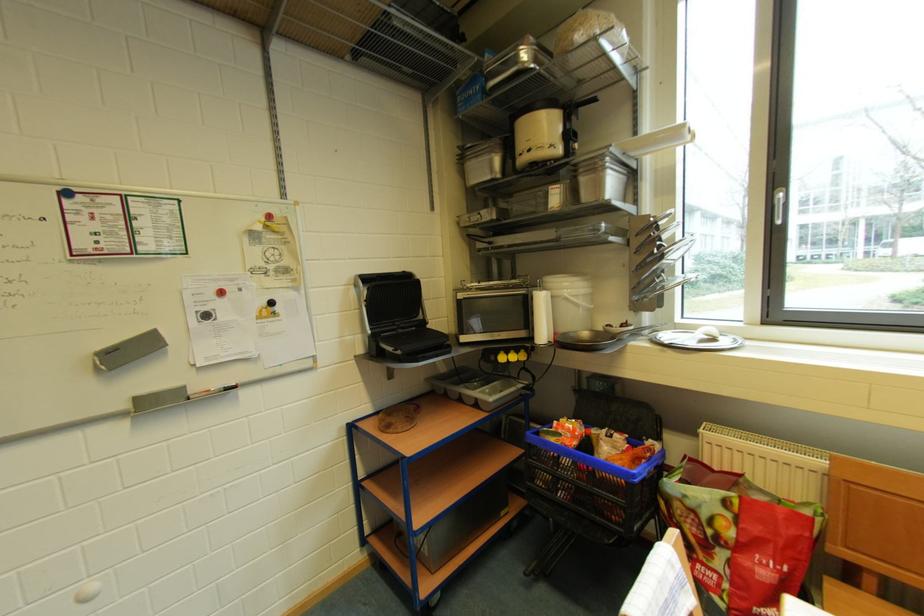
Describe the element at coordinates (697, 339) in the screenshot. I see `the white bucket lid` at that location.